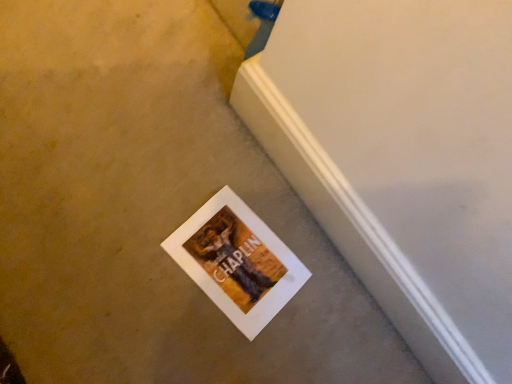
Find the location of `vacant area to the left of white matte picture frame at lower center`. vacant area to the left of white matte picture frame at lower center is located at coordinates (150, 191).